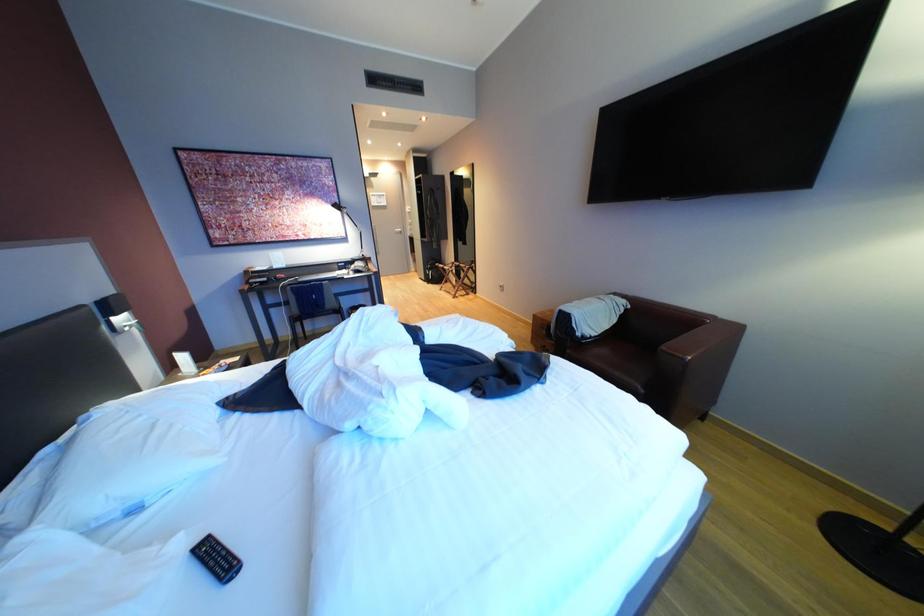
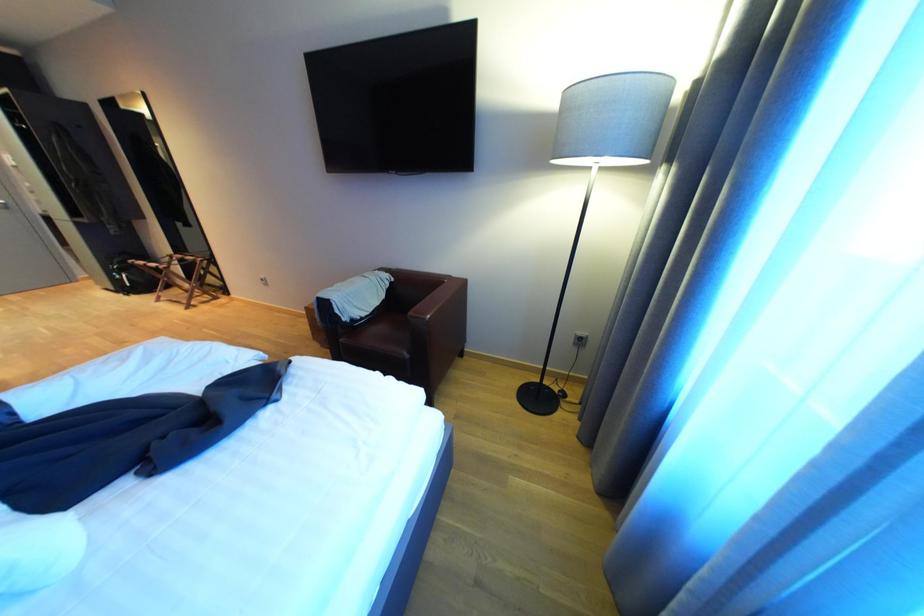
Question: The images are taken continuously from a first-person perspective. In which direction is your viewpoint rotating?

Choices:
 (A) Left
 (B) Right
 (C) Up
 (D) Down

Answer: (B)